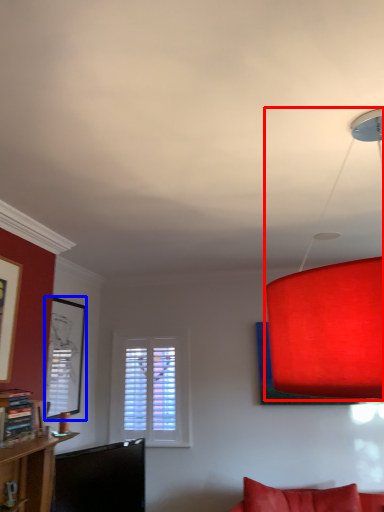
Question: Which of the following is the closest to the observer, lamp (highlighted by a red box) or picture frame (highlighted by a blue box)?

Choices:
 (A) lamp
 (B) picture frame

Answer: (A)